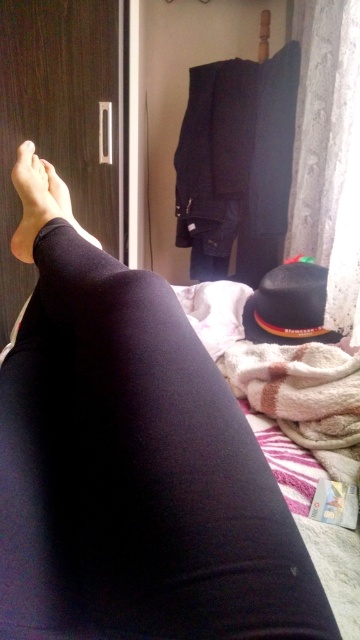
Question: Among these objects, which one is farthest from the camera?

Choices:
 (A) black matte leggings at lower left
 (B) matte black leg at lower left

Answer: (B)

Question: Estimate the real-world distances between objects in this image. Which object is closer to the black matte legging at lower left?

Choices:
 (A) black matte leggings at lower left
 (B) white textured curtain at right

Answer: (A)

Question: Does white textured curtain at right appear on the right side of black felt hat at lower right?

Choices:
 (A) no
 (B) yes

Answer: (B)

Question: From the image, what is the correct spatial relationship of white textured curtain at right in relation to black matte legging at lower left?

Choices:
 (A) above
 (B) below

Answer: (A)

Question: Which object is the farthest from the matte black leg at lower left?

Choices:
 (A) white textured curtain at right
 (B) black matte leggings at lower left
 (C) black matte legging at lower left
 (D) black felt hat at lower right

Answer: (A)

Question: Can you confirm if matte black leg at lower left is wider than black matte legging at lower left?

Choices:
 (A) no
 (B) yes

Answer: (A)